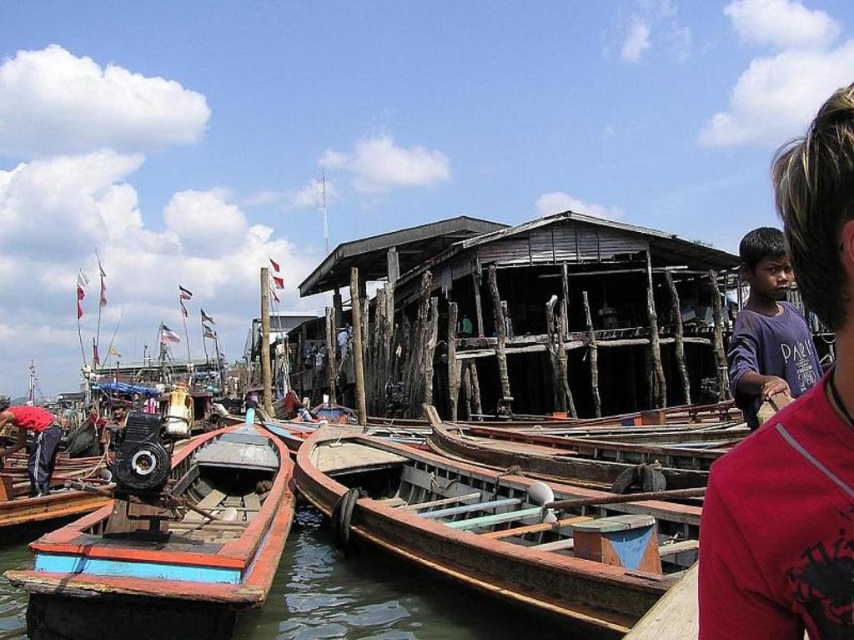
Question: Does dark blue t-shirt at center have a smaller size compared to dark blue jeans at lower left?

Choices:
 (A) no
 (B) yes

Answer: (B)

Question: Estimate the real-world distances between objects in this image. Which object is farther from the wooden boat at center?

Choices:
 (A) purple cotton shirt at upper right
 (B) dark blue jeans at lower left
 (C) dark blue t-shirt at center

Answer: (A)

Question: Among these objects, which one is farthest from the camera?

Choices:
 (A) wooden canoe at center
 (B) purple cotton shirt at upper right

Answer: (B)

Question: Which point is closer to the camera taking this photo?

Choices:
 (A) (x=41, y=458)
 (B) (x=803, y=385)
 (C) (x=788, y=404)

Answer: (C)

Question: Does dark blue t-shirt at center have a larger size compared to wooden boat at center?

Choices:
 (A) yes
 (B) no

Answer: (A)

Question: Is wooden canoe at center below purple cotton shirt at upper right?

Choices:
 (A) yes
 (B) no

Answer: (A)